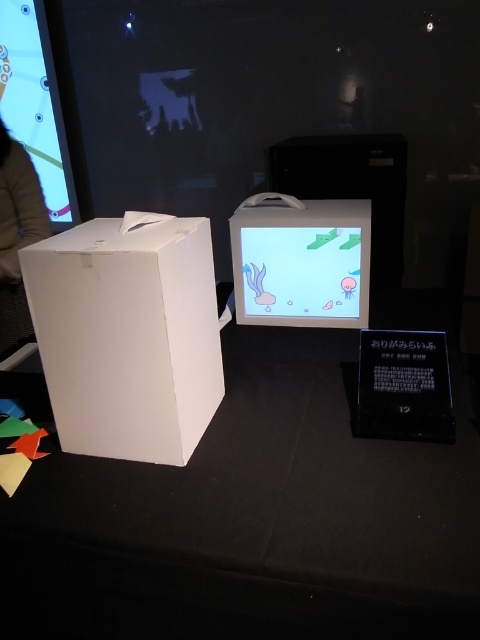
Can you confirm if black matte table at center is shorter than brown leather jacket at left?

In fact, black matte table at center may be taller than brown leather jacket at left.

Is point (243, 419) positioned behind point (45, 218)?

That is False.

This screenshot has width=480, height=640. Find the location of `black matte table at center`. black matte table at center is located at coordinates (259, 513).

Who is higher up, black matte table at center or matte plastic screen at center?

matte plastic screen at center is above.

Which is behind, point (328, 497) or point (296, 259)?

Positioned behind is point (296, 259).

Who is more forward, (456, 445) or (357, 259)?

Point (456, 445) is more forward.

Identify the location of black matte table at center. (259, 513).

Measure the distance between point (41, 275) and camera.

A distance of 1.10 meters exists between point (41, 275) and camera.

Is point (29, 294) closer to viewer compared to point (296, 244)?

Yes, point (29, 294) is in front of point (296, 244).

Where is `white matte cardboard box at left`? The width and height of the screenshot is (480, 640). white matte cardboard box at left is located at coordinates (128, 333).